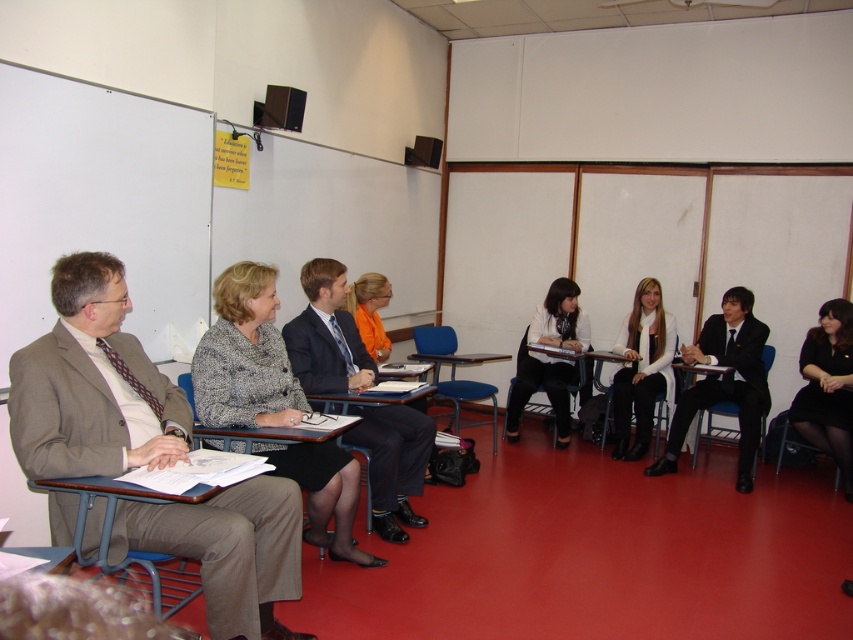
You are standing at the front of the classroom and want to move to the location of point [674,360]. However, there is an obstacle at point [834,316]. Can you walk directly to your destination without going around?

Point [834,316] is in front of point [674,360], so you cannot walk directly to point [674,360] without going around the obstacle at point [834,316].

You are a student who needs to place a 1.2 meter tall poster on a desk in the classroom. Which desk, the matte black desk at center or the wooden desk at center, can accommodate the poster without it exceeding the desk height?

The wooden desk at center is taller than the matte black desk at center, so the poster can be placed on the wooden desk at center without exceeding its height.